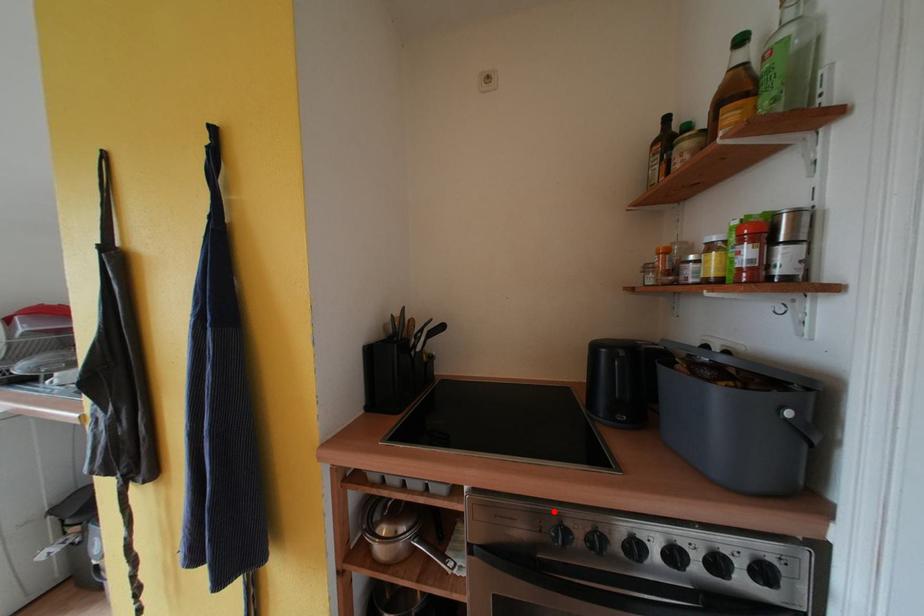
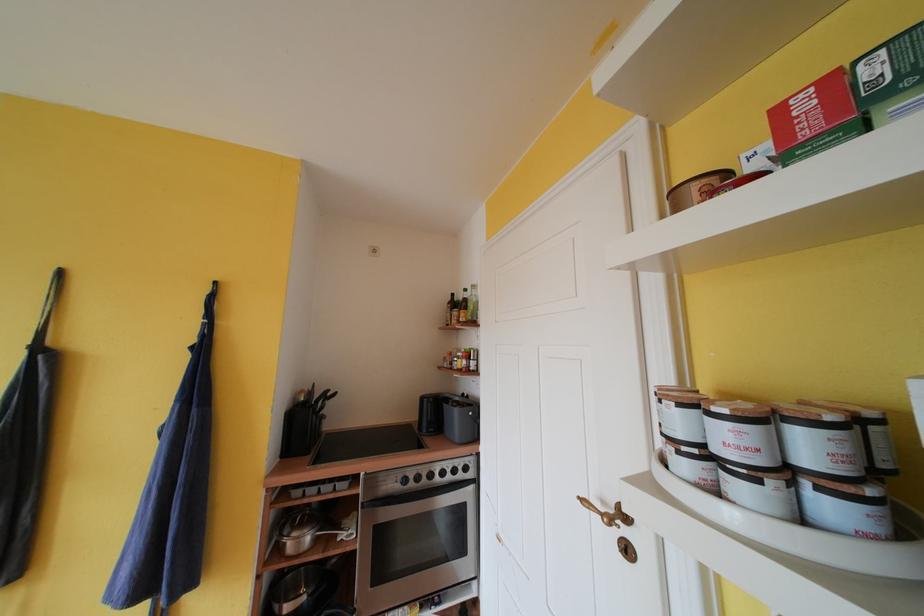
In the second image, find the point that corresponds to the highlighted location in the first image.

(406, 474)